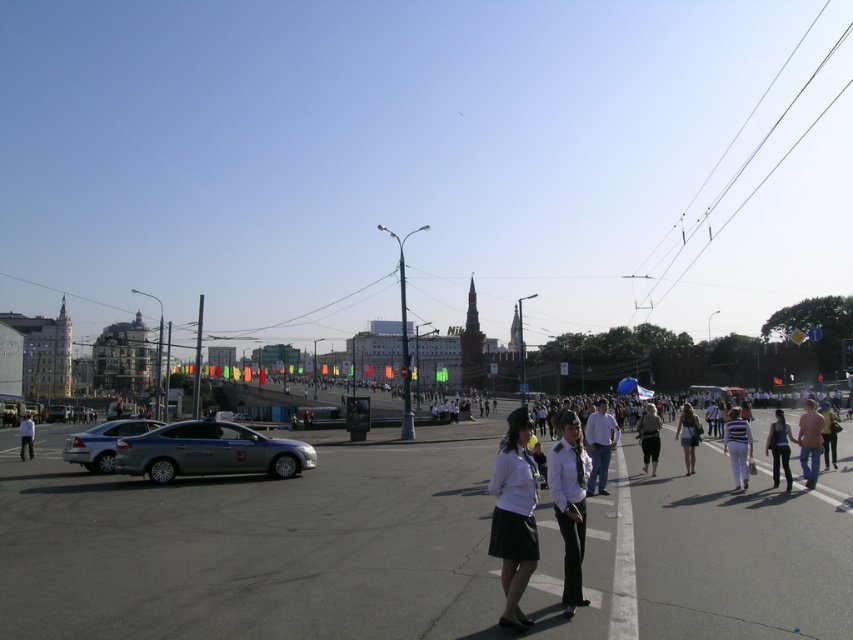
You are a pedestrian standing on the smooth asphalt road at center. You want to step down to the white shirt and black skirt at center. Is the ground lower there?

The smooth asphalt road at center is above the white shirt and black skirt at center, so stepping down would mean moving to lower ground.

You are a delivery drone flying above the city. You need to land on the smooth asphalt road at center. According to the coordinates provided, is the point at (252, 548) the correct location for landing?

Yes, the point at (252, 548) marks the smooth asphalt road at center, so it is the correct location for landing.

You are a photographer trying to capture a group photo of the two people in the scene. The camera you are using has a maximum subject width capacity of 1 meter. Given the white shirt and black skirt at center and the white shirt at center, can both subjects fit within the camera frame at the same time?

The white shirt and black skirt at center has a width less than the white shirt at center. Since the total width of both subjects combined would be more than 1 meter, they cannot fit within the camera frame at the same time.